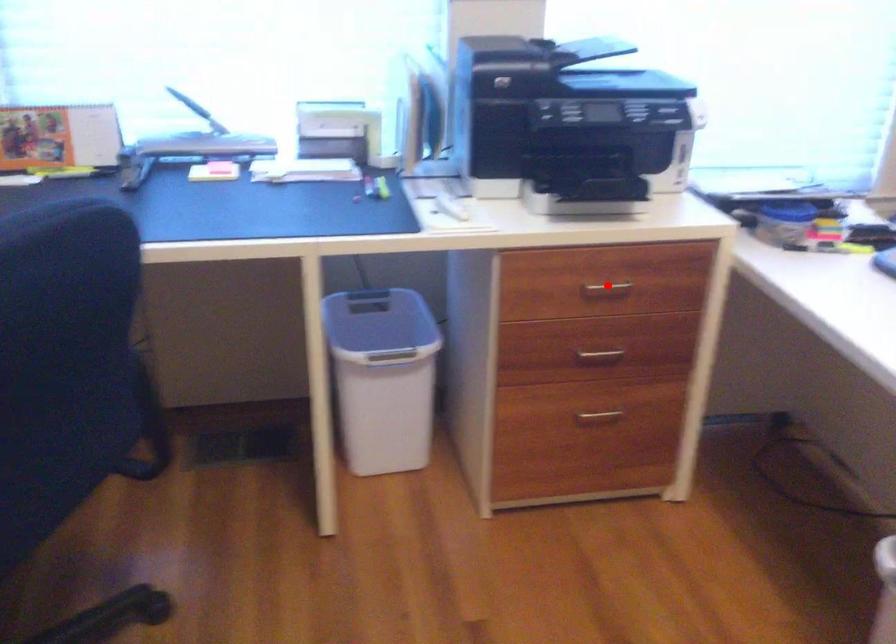
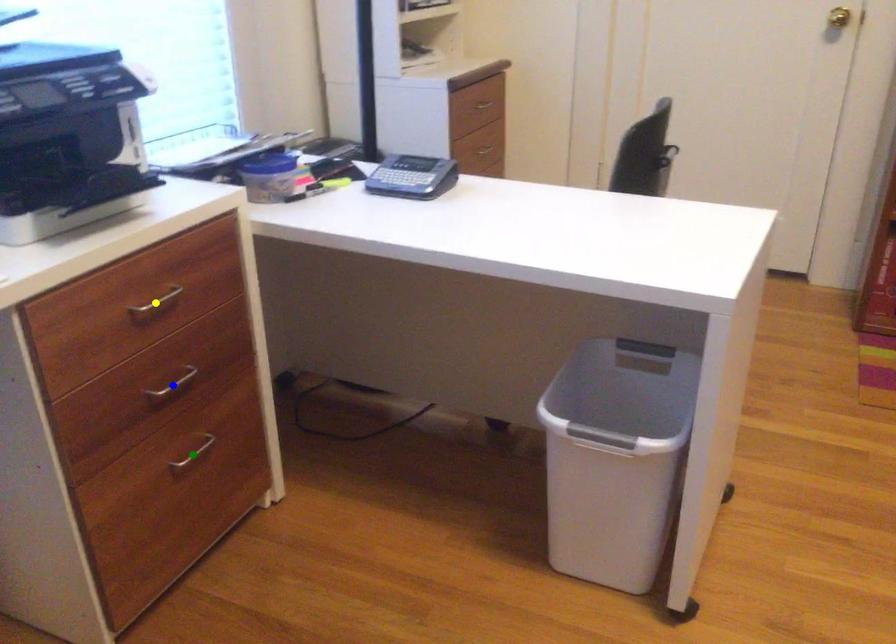
Question: I am providing you with two images of the same scene from different viewpoints. A red point is marked on the first image. You are given multiple points on the second image. Which point in image 2 represents the same 3d spot as the red point in image 1?

Choices:
 (A) green point
 (B) yellow point
 (C) blue point

Answer: (B)